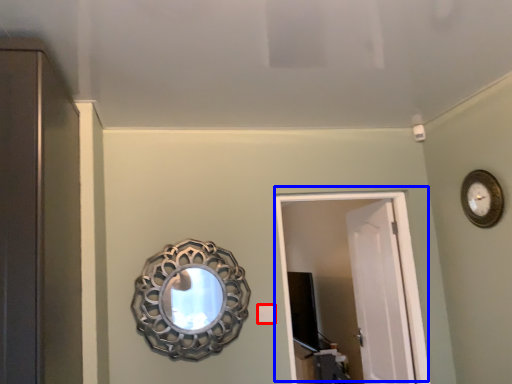
Question: Which point is closer to the camera, light switch (highlighted by a red box) or door (highlighted by a blue box)?

Choices:
 (A) light switch
 (B) door

Answer: (A)